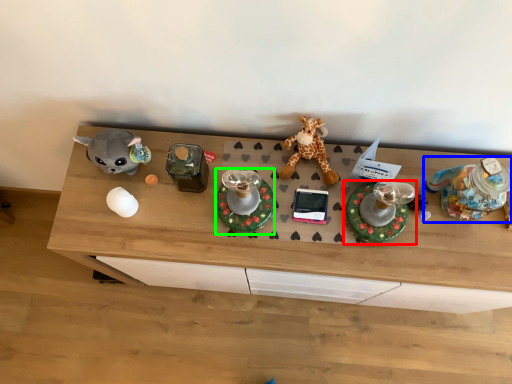
Question: Which object is positioned closest to toy (highlighted by a red box)? Select from toy (highlighted by a blue box) and toy (highlighted by a green box).

Choices:
 (A) toy
 (B) toy

Answer: (A)